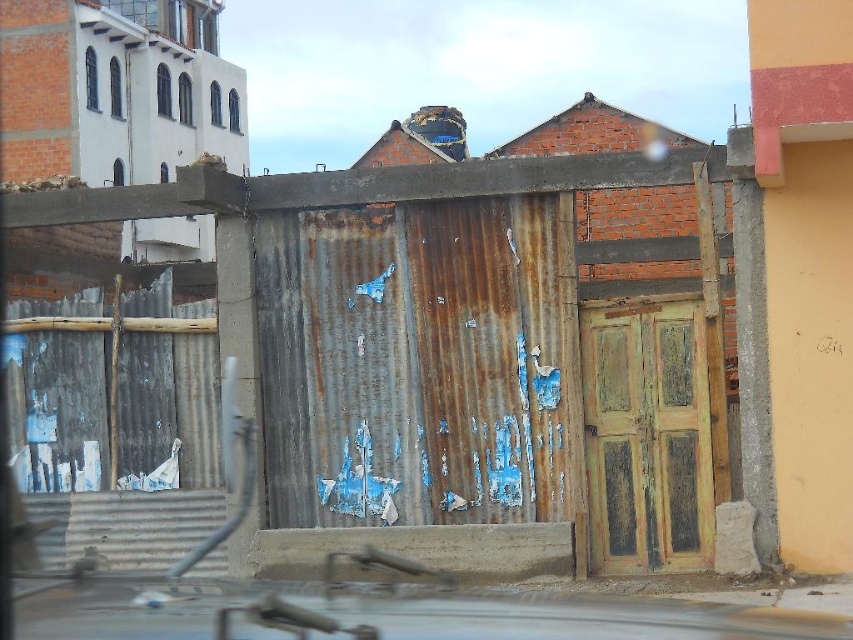
You are a delivery person trying to reach the rusty wooden door at center. There is a metallic car at lower center blocking your path. Can you walk around the car to reach the door?

The metallic car at lower center is positioned on the left side of the rusty wooden door at center, so you can walk around the car on the right side to reach the door.